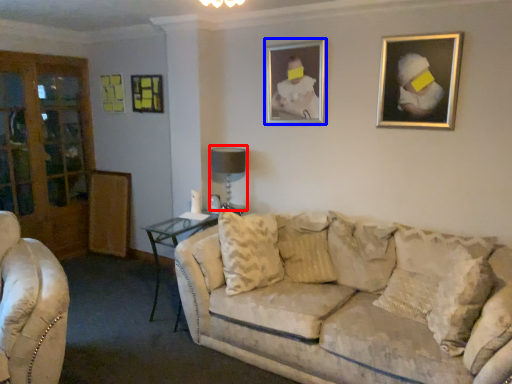
Question: Which point is closer to the camera, table lamp (highlighted by a red box) or picture frame (highlighted by a blue box)?

Choices:
 (A) table lamp
 (B) picture frame

Answer: (B)